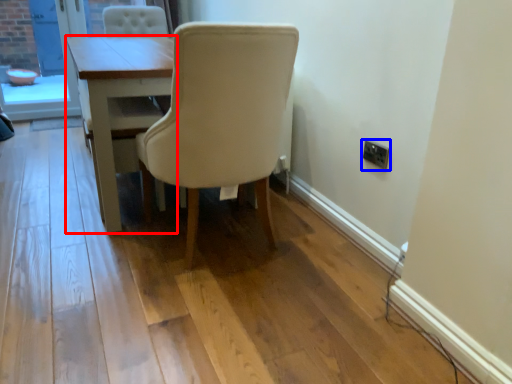
Question: Among these objects, which one is nearest to the camera, table (highlighted by a red box) or electric outlet (highlighted by a blue box)?

Choices:
 (A) table
 (B) electric outlet

Answer: (B)